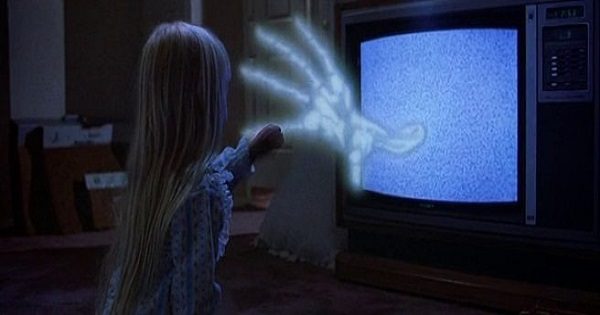
Locate an element on the screen. The height and width of the screenshot is (315, 600). brown floor is located at coordinates (301, 292).